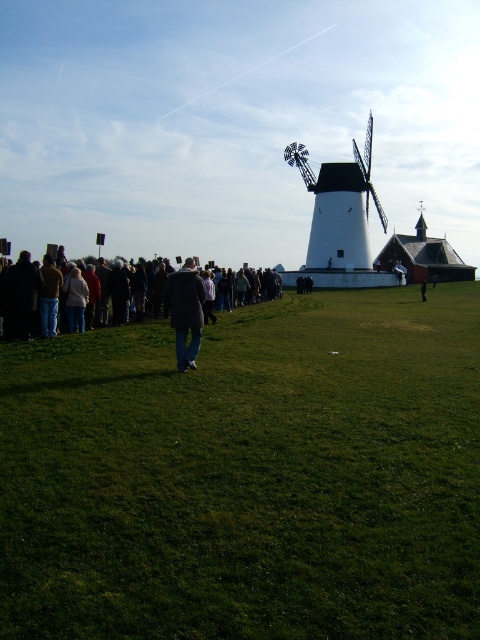
Question: Is green grassy field at lower center to the left of dark gray coat at center from the viewer's perspective?

Choices:
 (A) no
 (B) yes

Answer: (A)

Question: Is dark gray coat at center thinner than dark wool coat at center?

Choices:
 (A) yes
 (B) no

Answer: (B)

Question: Among these points, which one is nearest to the camera?

Choices:
 (A) (321, 250)
 (B) (424, 289)

Answer: (B)

Question: Estimate the real-world distances between objects in this image. Which object is farther from the white matte windmill at center?

Choices:
 (A) green grassy field at lower center
 (B) jeans at center
 (C) dark wool coat at center

Answer: (A)

Question: Among these objects, which one is nearest to the camera?

Choices:
 (A) green grassy field at lower center
 (B) white matte windmill at center
 (C) dark gray coat at center
 (D) jeans at center

Answer: (A)

Question: Considering the relative positions of green grassy field at lower center and dark gray coat at center in the image provided, where is green grassy field at lower center located with respect to dark gray coat at center?

Choices:
 (A) above
 (B) below

Answer: (B)